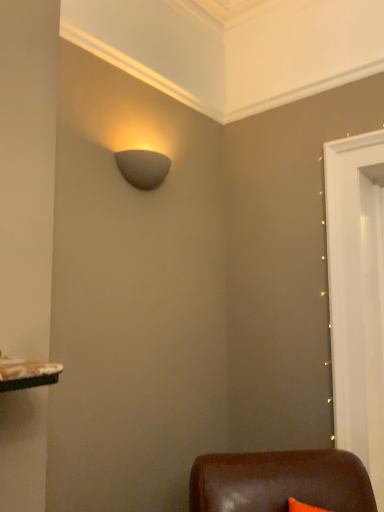
Describe the element at coordinates (143, 168) in the screenshot. I see `matte gray wall sconce at upper center` at that location.

The width and height of the screenshot is (384, 512). I want to click on matte gray wall sconce at upper center, so click(x=143, y=168).

The height and width of the screenshot is (512, 384). What are the coordinates of `matte gray wall sconce at upper center` in the screenshot? It's located at (143, 168).